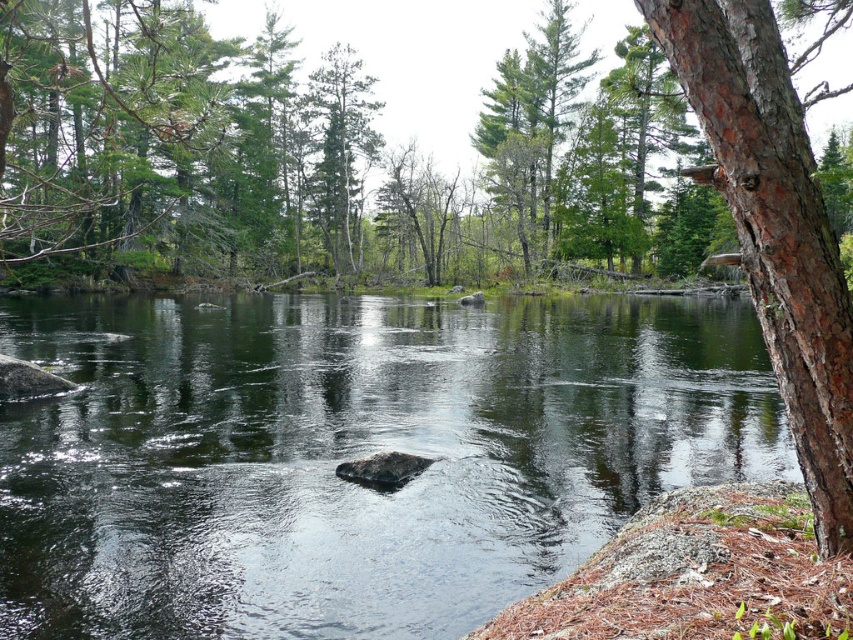
From the picture: Can you confirm if transparent water at center is bigger than brown rough bark tree at right?

Yes, transparent water at center is bigger than brown rough bark tree at right.

Which is more to the left, transparent water at center or brown rough bark tree at right?

From the viewer's perspective, transparent water at center appears more on the left side.

Who is more forward, (x=389, y=436) or (x=811, y=272)?

Point (x=811, y=272) is more forward.

Find the location of a particular element. This screenshot has height=640, width=853. transparent water at center is located at coordinates (352, 452).

Looking at this image, which is above, transparent water at center or green matte tree at center?

green matte tree at center is above.

Is transparent water at center to the right of green matte tree at center from the viewer's perspective?

Indeed, transparent water at center is positioned on the right side of green matte tree at center.

At what (x,y) coordinates should I click in order to perform the action: click on transparent water at center. Please return your answer as a coordinate pair (x, y). Image resolution: width=853 pixels, height=640 pixels. Looking at the image, I should click on (352, 452).

You are a GUI agent. You are given a task and a screenshot of the screen. Output one action in this format:
    pyautogui.click(x=<x>, y=<y>)
    Task: Click on the transparent water at center
    Image resolution: width=853 pixels, height=640 pixels.
    Given the screenshot: What is the action you would take?
    pyautogui.click(x=352, y=452)

Does brown rough bark tree at right have a greater height compared to green matte tree at center?

Incorrect, brown rough bark tree at right's height is not larger of green matte tree at center's.

Which is behind, point (786, 385) or point (370, 86)?

The point (370, 86) is more distant.

You are a GUI agent. You are given a task and a screenshot of the screen. Output one action in this format:
    pyautogui.click(x=<x>, y=<y>)
    Task: Click on the brown rough bark tree at right
    The height and width of the screenshot is (640, 853).
    Given the screenshot: What is the action you would take?
    pyautogui.click(x=775, y=228)